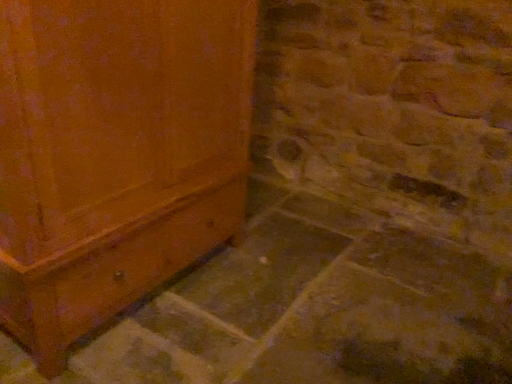
Measure the distance between matte wood cabinet at left and camera.

matte wood cabinet at left and camera are 32.41 inches apart from each other.

Where is `matte wood cabinet at left`? This screenshot has height=384, width=512. matte wood cabinet at left is located at coordinates 115,154.

Describe the element at coordinates (115, 154) in the screenshot. Image resolution: width=512 pixels, height=384 pixels. I see `matte wood cabinet at left` at that location.

What do you see at coordinates (311, 309) in the screenshot?
I see `smooth gray concrete at lower left` at bounding box center [311, 309].

You are a GUI agent. You are given a task and a screenshot of the screen. Output one action in this format:
    pyautogui.click(x=<x>, y=<y>)
    Task: Click on the smooth gray concrete at lower left
    The width and height of the screenshot is (512, 384).
    Given the screenshot: What is the action you would take?
    pyautogui.click(x=311, y=309)

This screenshot has height=384, width=512. I want to click on matte wood cabinet at left, so click(x=115, y=154).

Which object is positioned more to the right, matte wood cabinet at left or smooth gray concrete at lower left?

smooth gray concrete at lower left is more to the right.

Looking at this image, is matte wood cabinet at left positioned before smooth gray concrete at lower left?

No, matte wood cabinet at left is further to the viewer.

Does point (55, 91) lie behind point (501, 283)?

That is False.

From the image's perspective, which object appears higher, matte wood cabinet at left or smooth gray concrete at lower left?

From the image's view, matte wood cabinet at left is above.

From a real-world perspective, who is located lower, matte wood cabinet at left or smooth gray concrete at lower left?

From a 3D spatial view, smooth gray concrete at lower left is below.

Between matte wood cabinet at left and smooth gray concrete at lower left, which one has smaller width?

matte wood cabinet at left is thinner.

Does matte wood cabinet at left have a lesser height compared to smooth gray concrete at lower left?

Incorrect, the height of matte wood cabinet at left does not fall short of that of smooth gray concrete at lower left.

Does matte wood cabinet at left have a larger size compared to smooth gray concrete at lower left?

Yes, matte wood cabinet at left is bigger than smooth gray concrete at lower left.

Is matte wood cabinet at left positioned beyond the bounds of smooth gray concrete at lower left?

matte wood cabinet at left is positioned outside smooth gray concrete at lower left.

Is matte wood cabinet at left placed right next to smooth gray concrete at lower left?

They are not placed beside each other.

Is matte wood cabinet at left oriented towards smooth gray concrete at lower left?

Yes, matte wood cabinet at left is oriented towards smooth gray concrete at lower left.

Image resolution: width=512 pixels, height=384 pixels. I want to click on concrete located on the right of matte wood cabinet at left, so click(311, 309).

Which is more to the right, smooth gray concrete at lower left or matte wood cabinet at left?

Positioned to the right is smooth gray concrete at lower left.

Is smooth gray concrete at lower left positioned in front of matte wood cabinet at left?

Yes.

Does point (324, 250) come closer to viewer compared to point (103, 0)?

No.

From the image's perspective, is smooth gray concrete at lower left beneath matte wood cabinet at left?

Yes, from the image's perspective, smooth gray concrete at lower left is beneath matte wood cabinet at left.

From a real-world perspective, which object rests below the other?

In real-world perspective, smooth gray concrete at lower left is lower.

Can you confirm if smooth gray concrete at lower left is wider than matte wood cabinet at left?

Correct, the width of smooth gray concrete at lower left exceeds that of matte wood cabinet at left.

Who is shorter, smooth gray concrete at lower left or matte wood cabinet at left?

With less height is smooth gray concrete at lower left.

Who is smaller, smooth gray concrete at lower left or matte wood cabinet at left?

smooth gray concrete at lower left is smaller.

Would you say smooth gray concrete at lower left is outside matte wood cabinet at left?

Yes.

Is the surface of smooth gray concrete at lower left in direct contact with matte wood cabinet at left?

smooth gray concrete at lower left and matte wood cabinet at left are not in contact.

Is smooth gray concrete at lower left positioned with its back to matte wood cabinet at left?

That's not correct — smooth gray concrete at lower left is not looking away from matte wood cabinet at left.

In the scene shown: How different are the orientations of smooth gray concrete at lower left and matte wood cabinet at left in degrees?

The angle between the facing direction of smooth gray concrete at lower left and the facing direction of matte wood cabinet at left is 180 degrees.

Where is `furniture positioned vertically above the smooth gray concrete at lower left (from a real-world perspective)`? The height and width of the screenshot is (384, 512). furniture positioned vertically above the smooth gray concrete at lower left (from a real-world perspective) is located at coordinates (115, 154).

The image size is (512, 384). In order to click on furniture behind the smooth gray concrete at lower left in this screenshot , I will do `click(115, 154)`.

Find the location of a particular element. concrete in front of the matte wood cabinet at left is located at coordinates (311, 309).